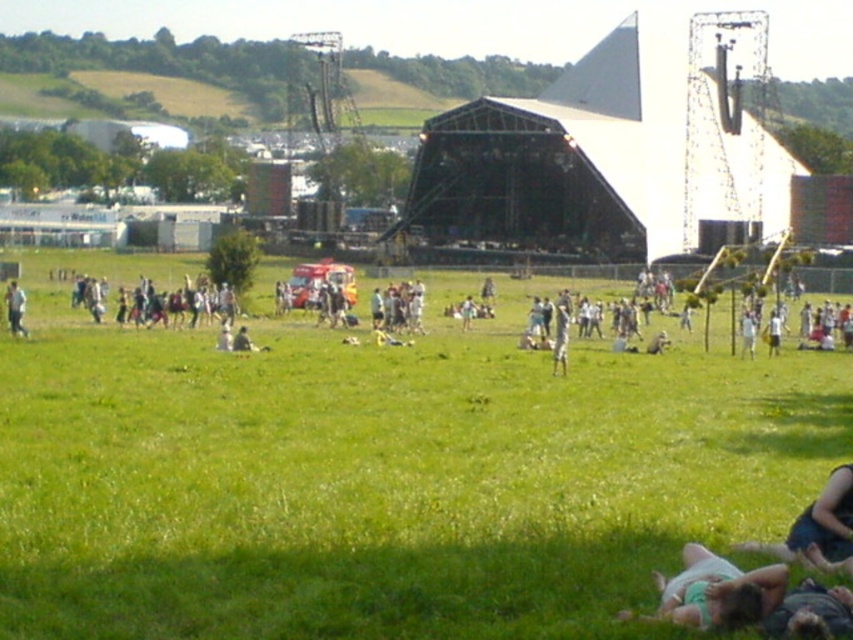
You are at a music festival and want to know if the white cotton shirt at center is within a safe distance from the white fabric person at center. The safety distance required is 100 feet. Can you confirm if they are following the safety guidelines?

The white cotton shirt at center and white fabric person at center are 116.40 feet apart, which exceeds the required 100 feet safety distance. They are following the safety guidelines.